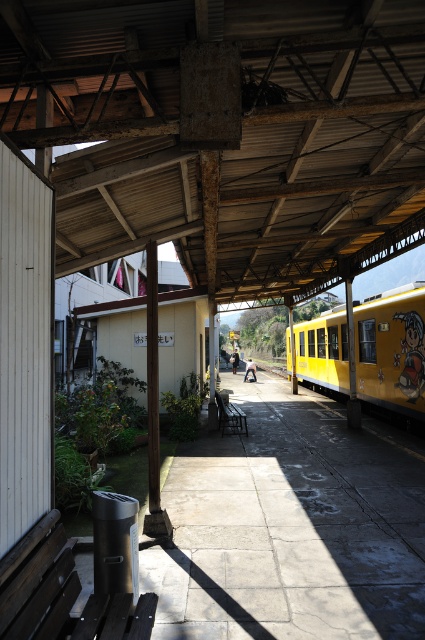
You are a passenger waiting for your train at the train station. You see the yellow matte train at right and the dark brown wooden bench at lower left. Which object is closer to you as you wait on the platform?

The yellow matte train at right is closer to you than the dark brown wooden bench at lower left because it is further to the viewer according to the description.

You are standing on the train station platform and want to walk from point (368, 362) to point (141, 605). Which direction should you move in to get closer to your destination?

To move from point (368, 362) to point (141, 605), you should move downward and to the right since point (141, 605) is closer to the viewer and positioned to the right compared to point (368, 362).